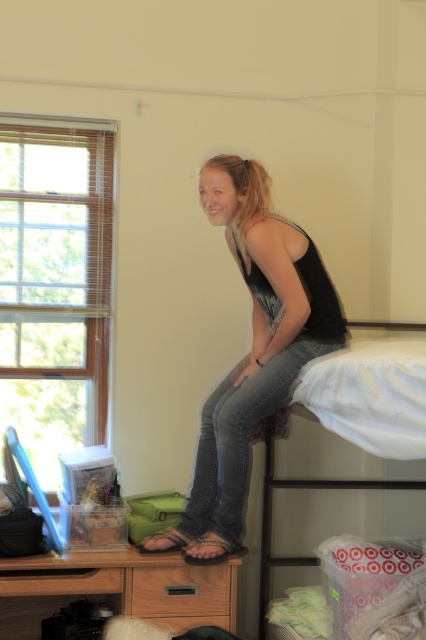
You are standing in the dormitory room and want to place a small plant between the two points, point (270, 324) and point (291, 477). Which point should the plant be closer to in order to be nearer to the viewer?

The plant should be placed closer to point (270, 324) because it is nearer to the viewer compared to point (291, 477).

Where is the black matte tank top at upper center located in the image?

The black matte tank top at upper center is located at the 2D coordinates point (252, 349).

Based on the photo, you are standing in the dormitory room and want to place a small decorative item on the bed. The bed is located at point (252, 349). Where exactly should you place the item to ensure it sits on the black matte tank top at upper center?

The black matte tank top at upper center is located at point (252, 349), so placing the item there will ensure it sits on the tank top.